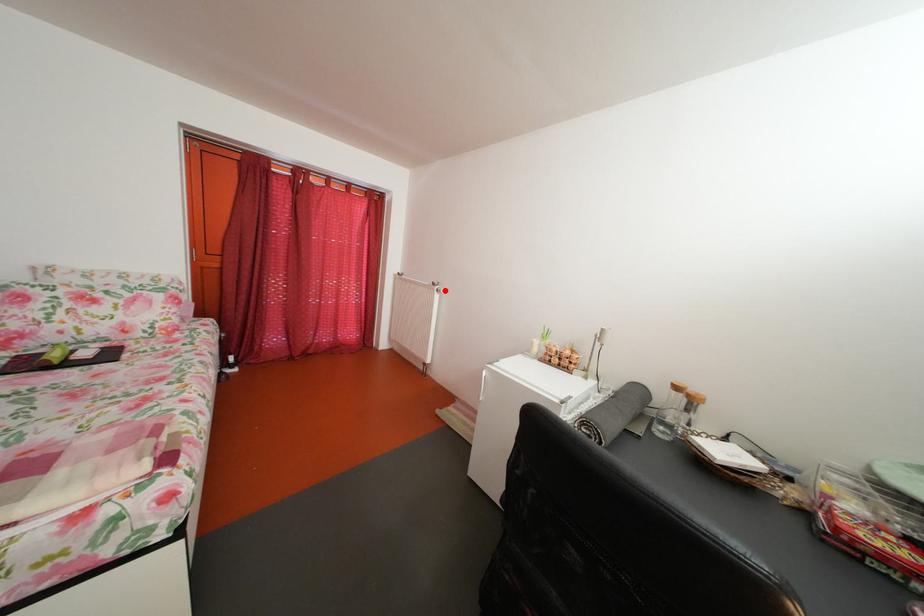
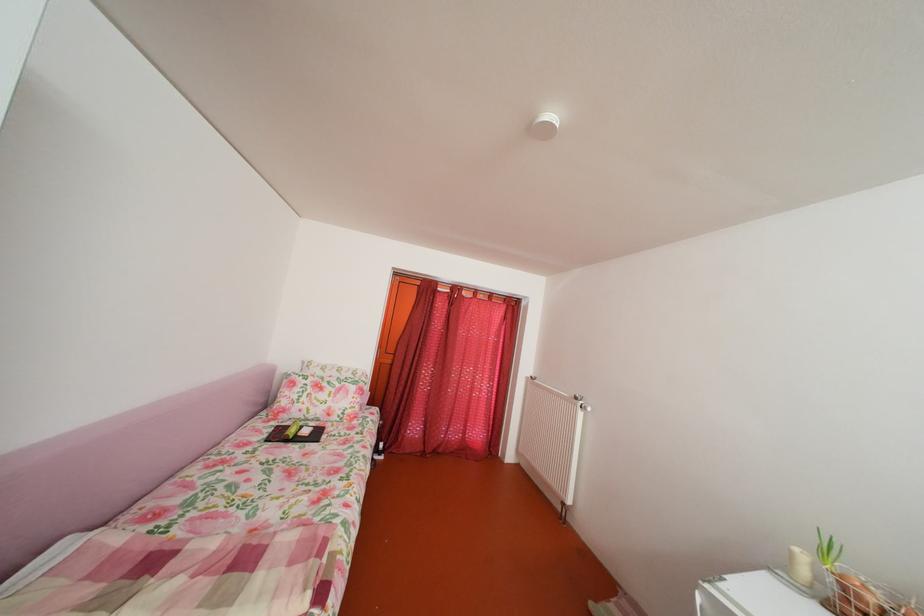
The point at the highlighted location is marked in the first image. Where is the corresponding point in the second image?

(588, 405)